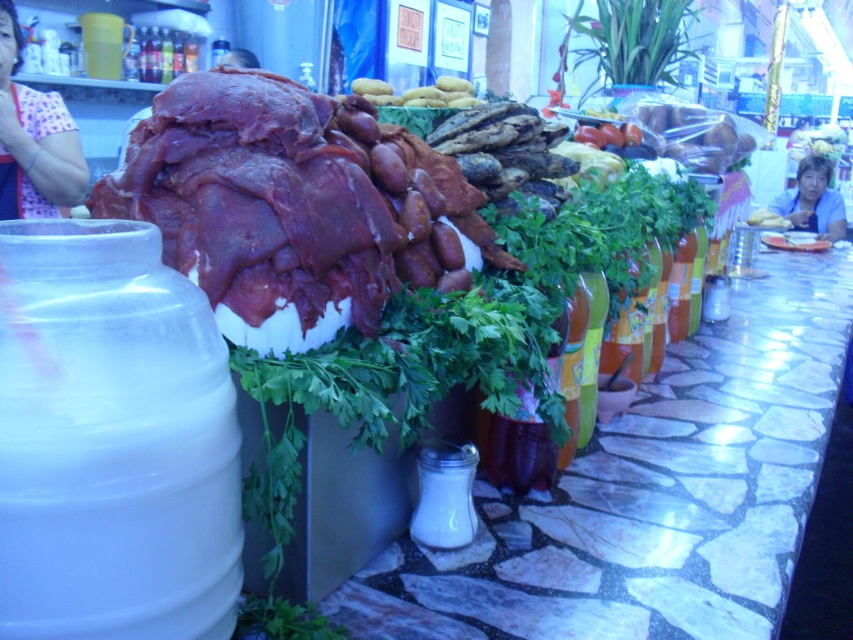
You are a customer at the market stall and want to grab the golden brown bread at center. However, the blue fabric shirt at upper right is blocking your view. Can you reach the bread without moving the shirt?

The golden brown bread at center is behind the blue fabric shirt at upper right, so you can reach it without moving the shirt as long as you can navigate around or behind the shirt.

You are a customer at the market stall and want to locate the blue fabric shirt at upper right. Where exactly is it positioned in the image?

The blue fabric shirt at upper right is positioned at point [813,200] in the image.

Consider the image. You are a customer at the market stall and see the pink floral shirt at upper left and the blue fabric shirt at upper right. Which shirt is located more to the left side of the market stall?

The pink floral shirt at upper left is more to the left side of the market stall than the blue fabric shirt at upper right.